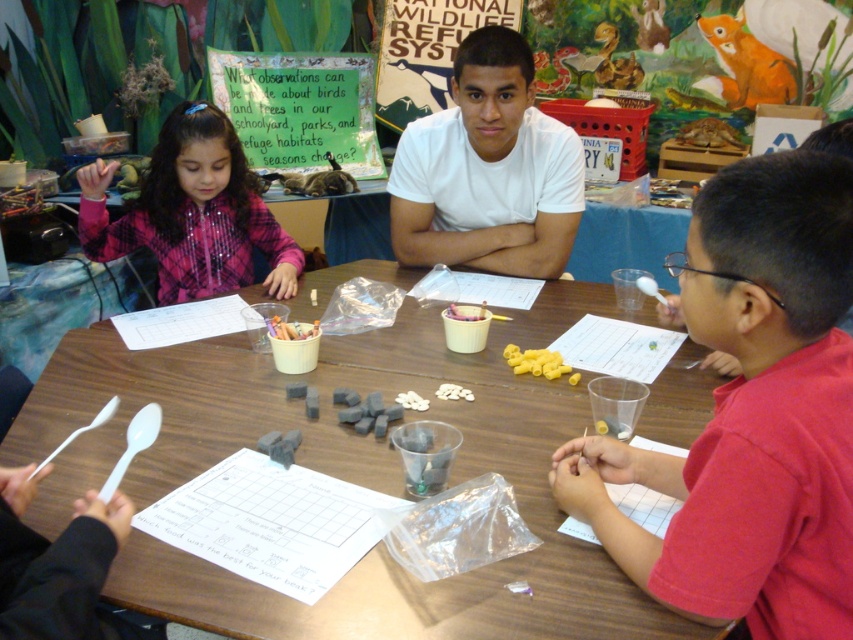
Does yellow matte pasta at center have a larger size compared to white plastic cup at center?

Correct, yellow matte pasta at center is larger in size than white plastic cup at center.

Who is taller, yellow matte pasta at center or white plastic cup at center?

With more height is yellow matte pasta at center.

Who is more distant from viewer, (576, 378) or (300, 330)?

The point (300, 330) is behind.

Locate an element on the screen. yellow matte pasta at center is located at coordinates (535, 362).

Is transparent plastic table at center below white matte cupcake at center?

Indeed, transparent plastic table at center is positioned under white matte cupcake at center.

Does transparent plastic table at center have a lesser height compared to white matte cupcake at center?

No.

Between point (424, 584) and point (461, 317), which one is positioned behind?

Point (461, 317)

Find the location of `transparent plastic table at center`. transparent plastic table at center is located at coordinates (340, 476).

Can you confirm if transparent plastic table at center is shorter than metallic gold sign at upper center?

No.

Which is behind, point (691, 396) or point (467, 17)?

The point (467, 17) is behind.

Between point (402, 310) and point (405, 100), which one is positioned in front?

Point (402, 310) is in front.

I want to click on transparent plastic table at center, so click(x=340, y=476).